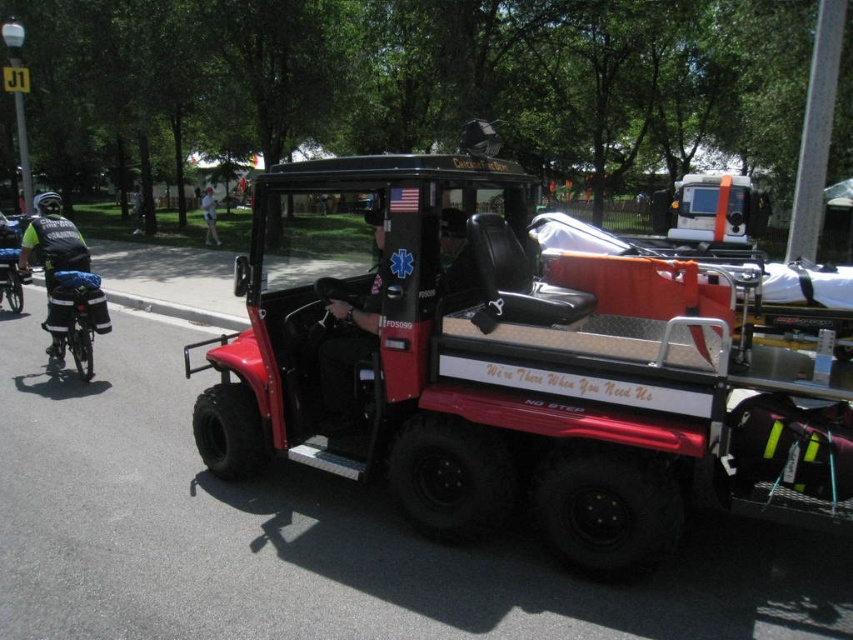
Question: Is red matte utility vehicle at center bigger than matte black helmet at center?

Choices:
 (A) yes
 (B) no

Answer: (A)

Question: Which object is positioned farthest from the blue fabric bag at left?

Choices:
 (A) matte black helmet at center
 (B) red matte utility vehicle at center
 (C) reflective blue helmet at left

Answer: (A)

Question: Observing the image, what is the correct spatial positioning of blue fabric bag at left in reference to light blue fabric shirt at center?

Choices:
 (A) right
 (B) left

Answer: (A)

Question: Considering the real-world distances, which object is closest to the light blue fabric shirt at center?

Choices:
 (A) matte black helmet at center
 (B) reflective blue helmet at left
 (C) blue fabric bag at left
 (D) red matte utility vehicle at center

Answer: (D)

Question: Among these points, which one is farthest from the camera?

Choices:
 (A) (210, 208)
 (B) (485, 339)
 (C) (80, 252)

Answer: (A)

Question: Does red matte utility vehicle at center appear under matte black helmet at center?

Choices:
 (A) yes
 (B) no

Answer: (B)